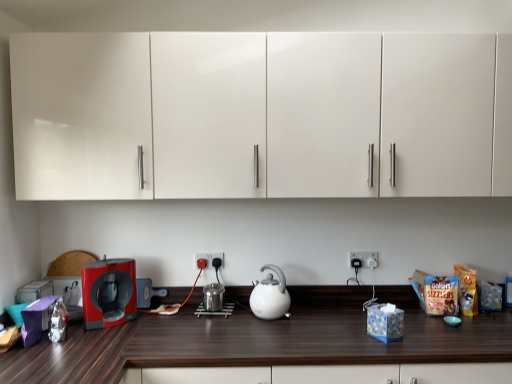
Question: From a real-world perspective, is white glossy kettle at center on white plastic electric outlet at center, acting as the second electric outlet starting from the left?

Choices:
 (A) yes
 (B) no

Answer: (B)

Question: Is white glossy kettle at center positioned far away from white plastic electric outlet at center, marked as the 1th electric outlet in a right-to-left arrangement?

Choices:
 (A) no
 (B) yes

Answer: (A)

Question: Is white glossy kettle at center touching white plastic electric outlet at center, acting as the second electric outlet starting from the left?

Choices:
 (A) no
 (B) yes

Answer: (A)

Question: Considering the relative sizes of white glossy kettle at center and white plastic electric outlet at center, acting as the second electric outlet starting from the left, in the image provided, is white glossy kettle at center thinner than white plastic electric outlet at center, acting as the second electric outlet starting from the left,?

Choices:
 (A) no
 (B) yes

Answer: (A)

Question: From a real-world perspective, is white glossy kettle at center physically below white plastic electric outlet at center, acting as the second electric outlet starting from the left?

Choices:
 (A) yes
 (B) no

Answer: (A)

Question: Is white glossy kettle at center turned away from white plastic electric outlet at center, acting as the second electric outlet starting from the left?

Choices:
 (A) yes
 (B) no

Answer: (B)

Question: Does white glossy cabinets at upper center have a lesser height compared to black plastic electric outlet at center, the first electric outlet viewed from the left?

Choices:
 (A) no
 (B) yes

Answer: (A)

Question: Is white glossy cabinets at upper center far from black plastic electric outlet at center, marked as the second electric outlet in a right-to-left arrangement?

Choices:
 (A) no
 (B) yes

Answer: (A)

Question: Is white glossy cabinets at upper center wider than black plastic electric outlet at center, marked as the second electric outlet in a right-to-left arrangement?

Choices:
 (A) no
 (B) yes

Answer: (B)

Question: Could you tell me if white glossy cabinets at upper center is turned towards black plastic electric outlet at center, the first electric outlet viewed from the left?

Choices:
 (A) no
 (B) yes

Answer: (A)

Question: Is white glossy cabinets at upper center closer to the viewer compared to black plastic electric outlet at center, marked as the second electric outlet in a right-to-left arrangement?

Choices:
 (A) yes
 (B) no

Answer: (A)

Question: Is white glossy cabinets at upper center outside of black plastic electric outlet at center, marked as the second electric outlet in a right-to-left arrangement?

Choices:
 (A) yes
 (B) no

Answer: (A)

Question: Does white plastic electric outlet at center, marked as the 1th electric outlet in a right-to-left arrangement, lie behind black plastic electric outlet at center, the first electric outlet viewed from the left?

Choices:
 (A) no
 (B) yes

Answer: (B)